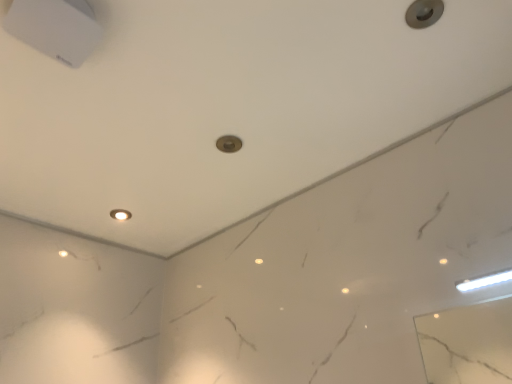
The image size is (512, 384). Describe the element at coordinates (424, 13) in the screenshot. I see `metallic gray knob at upper right` at that location.

This screenshot has height=384, width=512. I want to click on metallic gray knob at upper right, so click(424, 13).

Locate an element on the screen. The width and height of the screenshot is (512, 384). matte white light fixture at center is located at coordinates (120, 214).

The width and height of the screenshot is (512, 384). What do you see at coordinates (120, 214) in the screenshot? I see `matte white light fixture at center` at bounding box center [120, 214].

This screenshot has width=512, height=384. Identify the location of metallic gray knob at upper right. (424, 13).

Which is more to the left, matte white light fixture at center or metallic gray knob at upper right?

matte white light fixture at center.

Considering their positions, is matte white light fixture at center located in front of or behind metallic gray knob at upper right?

matte white light fixture at center is positioned farther from the viewer than metallic gray knob at upper right.

Is point (118, 218) behind point (429, 24)?

That is True.

From the image's perspective, does matte white light fixture at center appear higher than metallic gray knob at upper right?

Actually, matte white light fixture at center appears below metallic gray knob at upper right in the image.

Consider the image. From a real-world perspective, does matte white light fixture at center stand above metallic gray knob at upper right?

Yes, from a real-world perspective, matte white light fixture at center is over metallic gray knob at upper right

Does matte white light fixture at center have a lesser width compared to metallic gray knob at upper right?

Incorrect, the width of matte white light fixture at center is not less than that of metallic gray knob at upper right.

Does matte white light fixture at center have a lesser height compared to metallic gray knob at upper right?

In fact, matte white light fixture at center may be taller than metallic gray knob at upper right.

Considering the sizes of matte white light fixture at center and metallic gray knob at upper right in the image, is matte white light fixture at center bigger or smaller than metallic gray knob at upper right?

Considering their sizes, matte white light fixture at center takes up more space than metallic gray knob at upper right.

Is matte white light fixture at center inside the boundaries of metallic gray knob at upper right, or outside?

matte white light fixture at center is outside metallic gray knob at upper right.

Is there a large distance between matte white light fixture at center and metallic gray knob at upper right?

Yes.

Is matte white light fixture at center looking in the opposite direction of metallic gray knob at upper right?

matte white light fixture at center does not have its back to metallic gray knob at upper right.

How different are the orientations of matte white light fixture at center and metallic gray knob at upper right in degrees?

There is a 0.174-degree angle between the facing directions of matte white light fixture at center and metallic gray knob at upper right.

The height and width of the screenshot is (384, 512). I want to click on knob below the matte white light fixture at center (from a real-world perspective), so click(x=424, y=13).

Between metallic gray knob at upper right and matte white light fixture at center, which one appears on the left side from the viewer's perspective?

matte white light fixture at center is more to the left.

Is metallic gray knob at upper right closer to the viewer compared to matte white light fixture at center?

That is True.

Which is nearer, (424, 6) or (115, 218)?

Point (424, 6).

Consider the image. From the image's perspective, who appears lower, metallic gray knob at upper right or matte white light fixture at center?

From the image's view, matte white light fixture at center is below.

From a real-world perspective, does metallic gray knob at upper right sit lower than matte white light fixture at center?

Yes, from a real-world perspective, metallic gray knob at upper right is below matte white light fixture at center.

Is metallic gray knob at upper right wider than matte white light fixture at center?

No.

Does metallic gray knob at upper right have a greater height compared to matte white light fixture at center?

No.

Does metallic gray knob at upper right have a smaller size compared to matte white light fixture at center?

Correct, metallic gray knob at upper right occupies less space than matte white light fixture at center.

From the picture: Is matte white light fixture at center surrounded by metallic gray knob at upper right?

No, matte white light fixture at center is not inside metallic gray knob at upper right.

Consider the image. Is metallic gray knob at upper right in contact with matte white light fixture at center?

They are not placed beside each other.

Could you tell me if metallic gray knob at upper right is facing matte white light fixture at center?

No, metallic gray knob at upper right is not facing towards matte white light fixture at center.

How many degrees apart are the facing directions of metallic gray knob at upper right and matte white light fixture at center?

0.174 degrees separate the facing orientations of metallic gray knob at upper right and matte white light fixture at center.

Identify the location of knob below the matte white light fixture at center (from a real-world perspective). The image size is (512, 384). (424, 13).

Locate an element on the screen. The image size is (512, 384). knob in front of the matte white light fixture at center is located at coordinates (424, 13).

This screenshot has width=512, height=384. I want to click on knob above the matte white light fixture at center (from the image's perspective), so click(x=424, y=13).